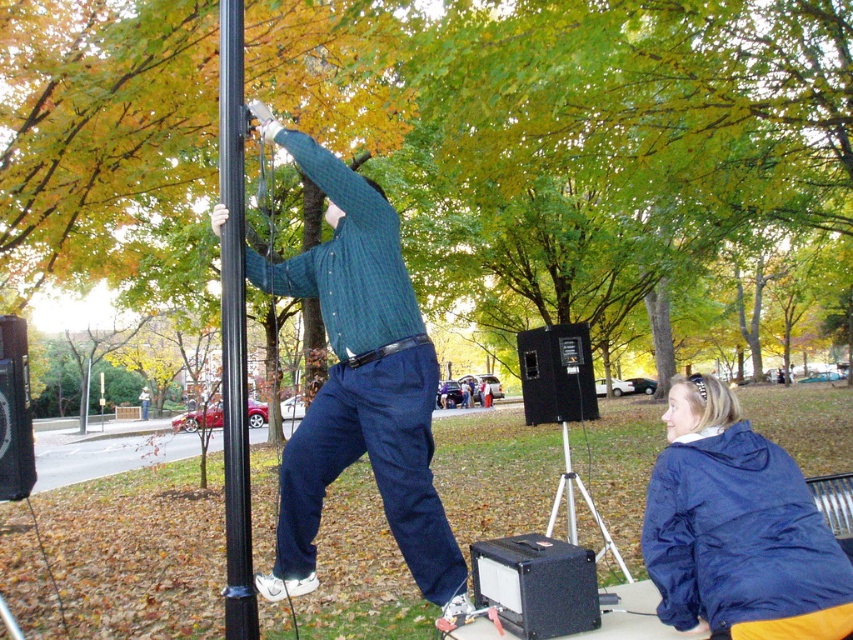
Is point (219, 152) in front of point (561, 496)?

Yes.

Does black metal pole at center lie in front of black matte tripod at lower center?

Yes, it is in front of black matte tripod at lower center.

Is point (223, 12) closer to camera compared to point (598, 513)?

Yes, point (223, 12) is closer to viewer.

Identify the location of black metal pole at center. The image size is (853, 640). (234, 330).

Is green leafy tree at upper center positioned before black matte tripod at lower center?

No, it is behind black matte tripod at lower center.

Does green leafy tree at upper center appear on the left side of black matte tripod at lower center?

Incorrect, green leafy tree at upper center is not on the left side of black matte tripod at lower center.

At what (x,y) coordinates should I click in order to perform the action: click on green leafy tree at upper center. Please return your answer as a coordinate pair (x, y). Looking at the image, I should click on (575, 134).

At what (x,y) coordinates should I click in order to perform the action: click on green leafy tree at upper center. Please return your answer as a coordinate pair (x, y). The height and width of the screenshot is (640, 853). Looking at the image, I should click on (575, 134).

Measure the distance between green leafy tree at upper center and camera.

They are 5.45 meters apart.

Can you confirm if green leafy tree at upper center is positioned to the right of green knitted sweater at center?

Yes, green leafy tree at upper center is to the right of green knitted sweater at center.

You are a GUI agent. You are given a task and a screenshot of the screen. Output one action in this format:
    pyautogui.click(x=<x>, y=<y>)
    Task: Click on the green leafy tree at upper center
    
    Given the screenshot: What is the action you would take?
    pyautogui.click(x=575, y=134)